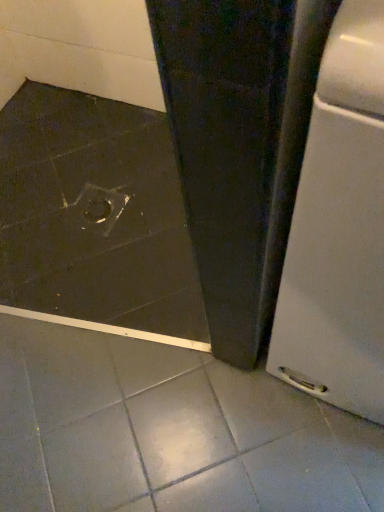
Question: Considering the positions of white matte refrigerator at lower right and transparent plastic drain at center in the image, is white matte refrigerator at lower right taller or shorter than transparent plastic drain at center?

Choices:
 (A) tall
 (B) short

Answer: (A)

Question: Considering the positions of white matte refrigerator at lower right and transparent plastic drain at center in the image, is white matte refrigerator at lower right wider or thinner than transparent plastic drain at center?

Choices:
 (A) thin
 (B) wide

Answer: (B)

Question: From a real-world perspective, relative to transparent plastic drain at center, is white matte refrigerator at lower right vertically above or below?

Choices:
 (A) below
 (B) above

Answer: (B)

Question: In terms of width, does transparent plastic drain at center look wider or thinner when compared to white matte refrigerator at lower right?

Choices:
 (A) thin
 (B) wide

Answer: (A)

Question: Is point (102, 221) closer or farther from the camera than point (281, 357)?

Choices:
 (A) closer
 (B) farther

Answer: (B)

Question: Considering the positions of transparent plastic drain at center and white matte refrigerator at lower right in the image, is transparent plastic drain at center bigger or smaller than white matte refrigerator at lower right?

Choices:
 (A) big
 (B) small

Answer: (B)

Question: From the image's perspective, is transparent plastic drain at center located above or below white matte refrigerator at lower right?

Choices:
 (A) below
 (B) above

Answer: (B)